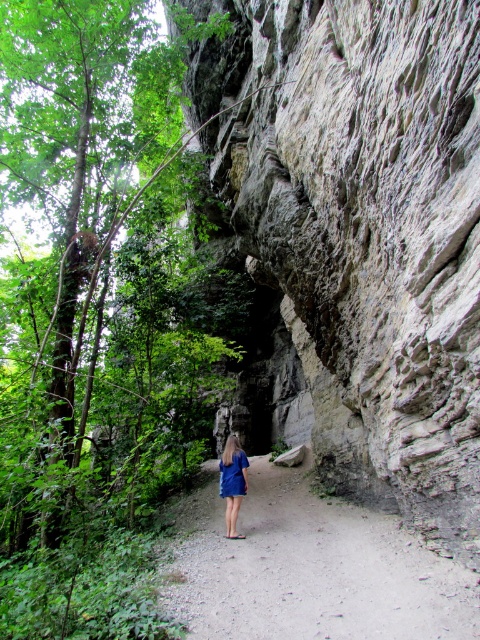
Question: Among these points, which one is nearest to the camera?

Choices:
 (A) (330, 108)
 (B) (231, 483)
 (C) (238, 468)

Answer: (A)

Question: Is blue fabric dress at center thinner than blue satin dress at center?

Choices:
 (A) no
 (B) yes

Answer: (A)

Question: Is dirt path at center smaller than blue fabric dress at center?

Choices:
 (A) yes
 (B) no

Answer: (B)

Question: Which point appears farthest from the camera in this image?

Choices:
 (A) (286, 214)
 (B) (288, 550)
 (C) (240, 493)

Answer: (A)

Question: Can you confirm if gray rough rock face at center is positioned to the left of blue satin dress at center?

Choices:
 (A) yes
 (B) no

Answer: (B)

Question: Which of the following is the closest to the observer?

Choices:
 (A) (236, 438)
 (B) (222, 460)

Answer: (B)